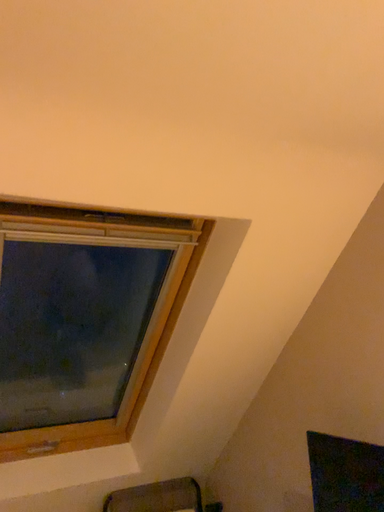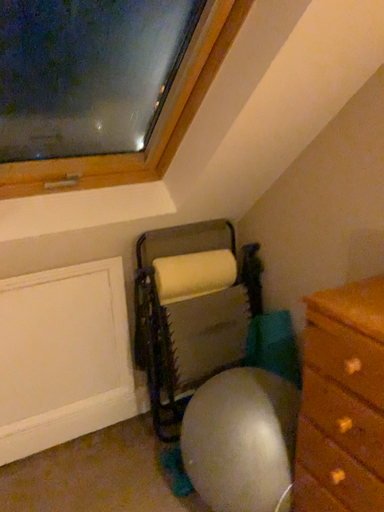
Question: How did the camera likely rotate when shooting the video?

Choices:
 (A) rotated upward
 (B) rotated downward

Answer: (B)